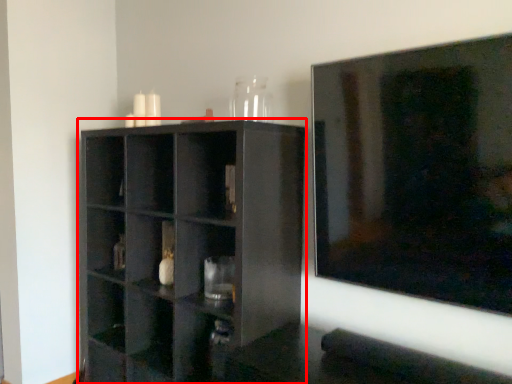
Question: From the image, what is the correct spatial relationship of shelf (annotated by the red box) in relation to glass vase?

Choices:
 (A) right
 (B) left

Answer: (B)